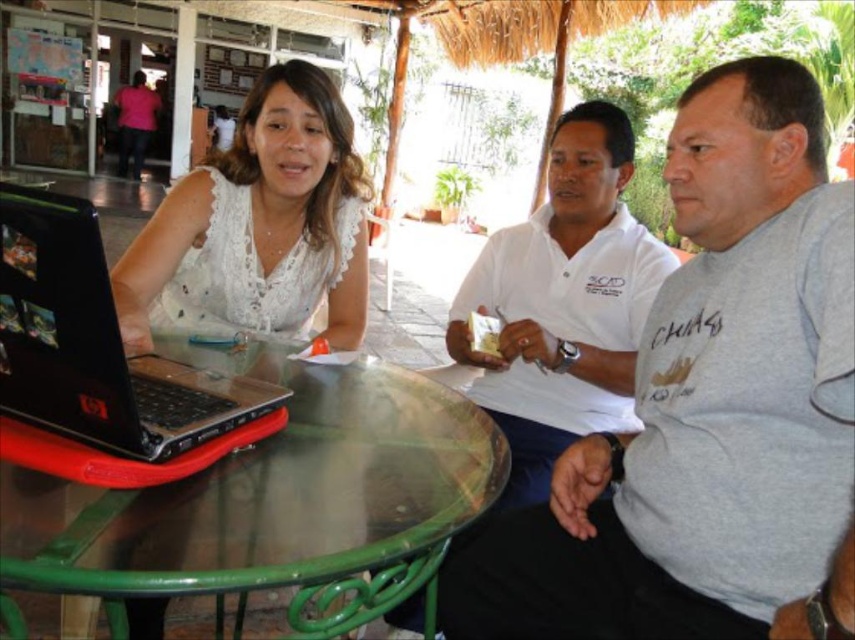
Question: Does gray cotton shirt at center appear on the right side of white lace blouse at center?

Choices:
 (A) yes
 (B) no

Answer: (A)

Question: In this image, where is gray cotton shirt at center located relative to transparent glass table at center?

Choices:
 (A) right
 (B) left

Answer: (A)

Question: Among these objects, which one is farthest from the camera?

Choices:
 (A) black plastic laptop at left
 (B) gray cotton shirt at center
 (C) white cotton shirt at center

Answer: (C)

Question: Which object is the farthest from the white lace blouse at center?

Choices:
 (A) white cotton shirt at center
 (B) transparent glass table at center
 (C) black plastic laptop at left
 (D) gray cotton shirt at center

Answer: (D)

Question: Can you confirm if gray cotton shirt at center is positioned below white cotton shirt at center?

Choices:
 (A) yes
 (B) no

Answer: (A)

Question: Which of these objects is positioned farthest from the black plastic laptop at left?

Choices:
 (A) gray cotton shirt at center
 (B) transparent glass table at center
 (C) white cotton shirt at center

Answer: (C)